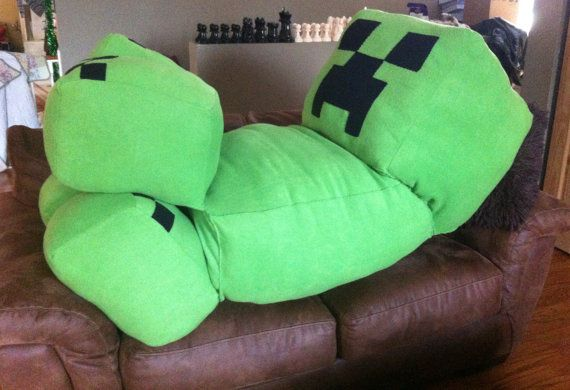
In order to click on hardwood floor in this screenshot , I will do `click(544, 351)`.